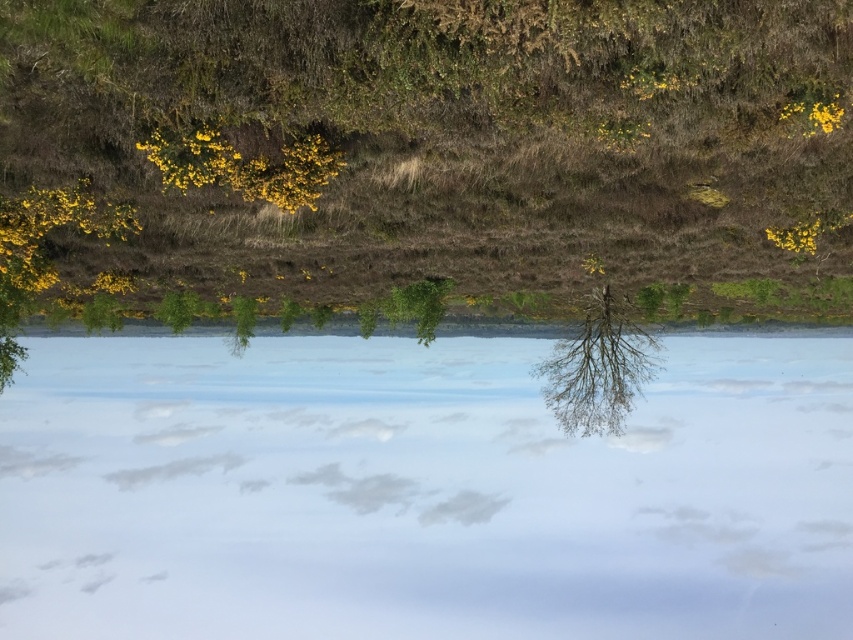
You are standing in the natural scene and want to walk from the point closer to you to the point further away. Which path would you take between the two points, point [181,492] and point [616,310]?

The path from point [181,492] to point [616,310] would require moving away from the viewer since point [181,492] is closer and point [616,310] is further away.

You are a hiker who wants to cross the transparent glass water at center to reach the other side. The bare branches tree at center is in your path. Can you safely walk around the tree and still cross the water?

The distance between the transparent glass water at center and the bare branches tree at center is 14.85 meters, so yes, you can safely walk around the tree and cross the water since there is enough space between them.

You are standing in the scene and want to walk towards the transparent glass water at center and the bare branches tree at center. Which object will you reach first?

You will reach the transparent glass water at center first because it is closer to you than the bare branches tree at center, as it is further away.